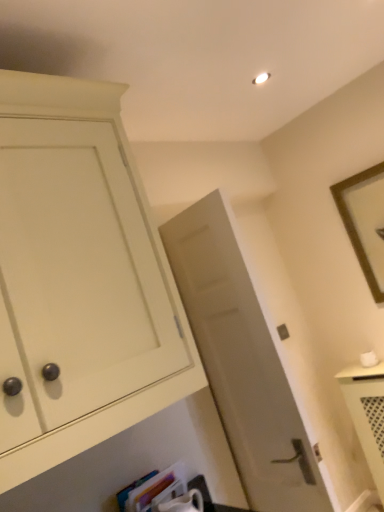
Question: Is matte gray door at center shorter than matte white cabinet at left?

Choices:
 (A) yes
 (B) no

Answer: (B)

Question: Can you confirm if matte gray door at center is thinner than matte white cabinet at left?

Choices:
 (A) no
 (B) yes

Answer: (B)

Question: Is matte gray door at center far from matte white cabinet at left?

Choices:
 (A) no
 (B) yes

Answer: (A)

Question: Could matte white cabinet at left be considered to be inside matte gray door at center?

Choices:
 (A) yes
 (B) no

Answer: (B)

Question: Can you confirm if matte gray door at center is bigger than matte white cabinet at left?

Choices:
 (A) yes
 (B) no

Answer: (B)

Question: Does matte gray door at center have a greater height compared to matte white cabinet at left?

Choices:
 (A) yes
 (B) no

Answer: (A)

Question: Is brown wooden picture frame at upper right next to hardcover book at lower center?

Choices:
 (A) no
 (B) yes

Answer: (A)

Question: From a real-world perspective, is brown wooden picture frame at upper right under hardcover book at lower center?

Choices:
 (A) no
 (B) yes

Answer: (A)

Question: Is brown wooden picture frame at upper right looking in the opposite direction of hardcover book at lower center?

Choices:
 (A) yes
 (B) no

Answer: (B)

Question: Is brown wooden picture frame at upper right smaller than hardcover book at lower center?

Choices:
 (A) yes
 (B) no

Answer: (B)

Question: From the image's perspective, would you say brown wooden picture frame at upper right is positioned over hardcover book at lower center?

Choices:
 (A) no
 (B) yes

Answer: (B)

Question: Considering the relative positions of brown wooden picture frame at upper right and hardcover book at lower center in the image provided, is brown wooden picture frame at upper right to the left of hardcover book at lower center from the viewer's perspective?

Choices:
 (A) yes
 (B) no

Answer: (B)

Question: Would you say matte gray door at center is part of matte white cabinet at left's contents?

Choices:
 (A) no
 (B) yes

Answer: (A)